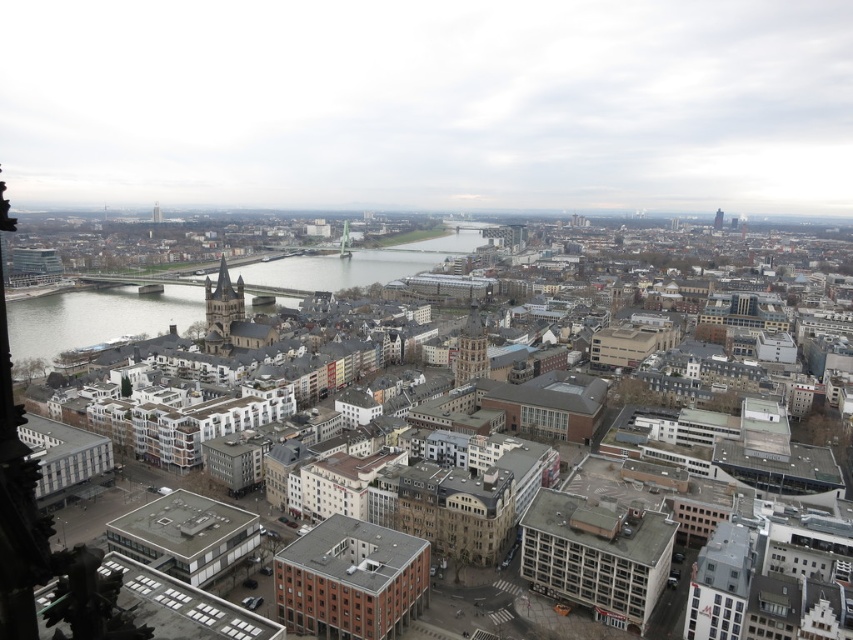
You are a drone operator tasked with flying a drone between the red brick tower at upper right and the smooth gray tower at upper left. The drone has a maximum flight distance of 500 meters. Can the drone safely complete the flight between these two towers without exceeding its range?

The red brick tower at upper right is 547.81 meters away from the smooth gray tower at upper left. Since the drone has a maximum flight distance of 500 meters, it cannot safely complete the flight between these two towers without exceeding its range.